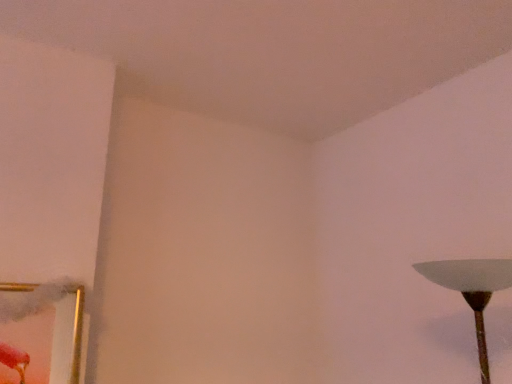
Find the location of a particular element. The height and width of the screenshot is (384, 512). metallic gold picture frame at lower left is located at coordinates (77, 332).

The width and height of the screenshot is (512, 384). Describe the element at coordinates (77, 332) in the screenshot. I see `metallic gold picture frame at lower left` at that location.

In order to face metallic gold picture frame at lower left, should I rotate leftwards or rightwards?

To align with it, rotate left about 25.870°.

The height and width of the screenshot is (384, 512). Identify the location of metallic gold picture frame at lower left. (77, 332).